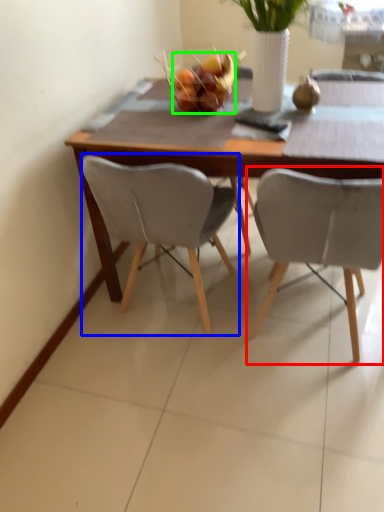
Question: Based on their relative distances, which object is farther from chair (highlighted by a red box)? Choose from chair (highlighted by a blue box) and fruit (highlighted by a green box).

Choices:
 (A) chair
 (B) fruit

Answer: (B)